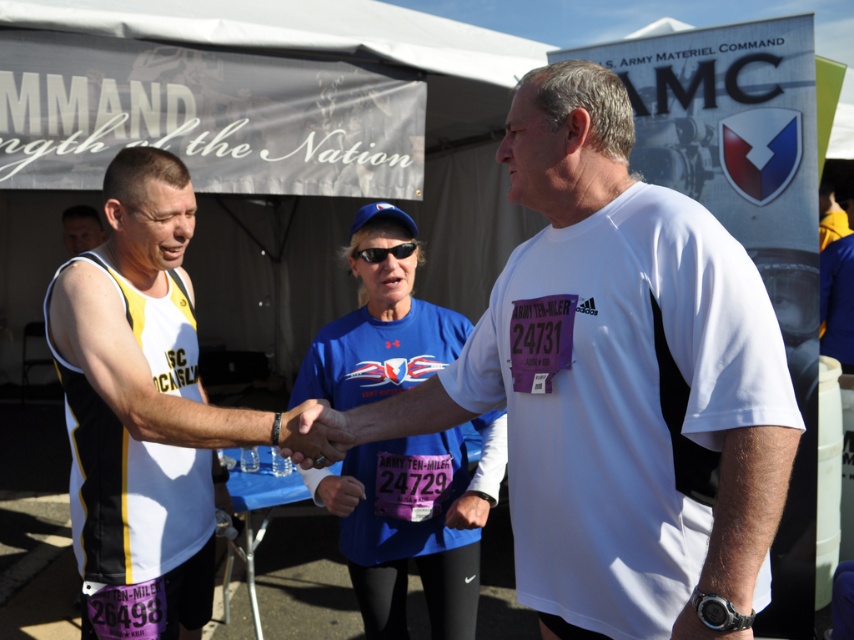
Question: Is white jersey at center below blue fabric shirt at center?

Choices:
 (A) yes
 (B) no

Answer: (B)

Question: Estimate the real-world distances between objects in this image. Which object is closer to the blue fabric shirt at center?

Choices:
 (A) white jersey at center
 (B) white matte t-shirt at center

Answer: (A)

Question: Which of the following is the closest to the observer?

Choices:
 (A) [626, 483]
 (B) [373, 490]
 (C) [129, 328]

Answer: (A)

Question: Which of these objects is positioned closest to the blue fabric shirt at center?

Choices:
 (A) white jersey at center
 (B) white matte t-shirt at center

Answer: (A)

Question: Is white jersey at center wider than blue fabric shirt at center?

Choices:
 (A) yes
 (B) no

Answer: (A)

Question: Can you confirm if white jersey at center is wider than blue fabric shirt at center?

Choices:
 (A) no
 (B) yes

Answer: (B)